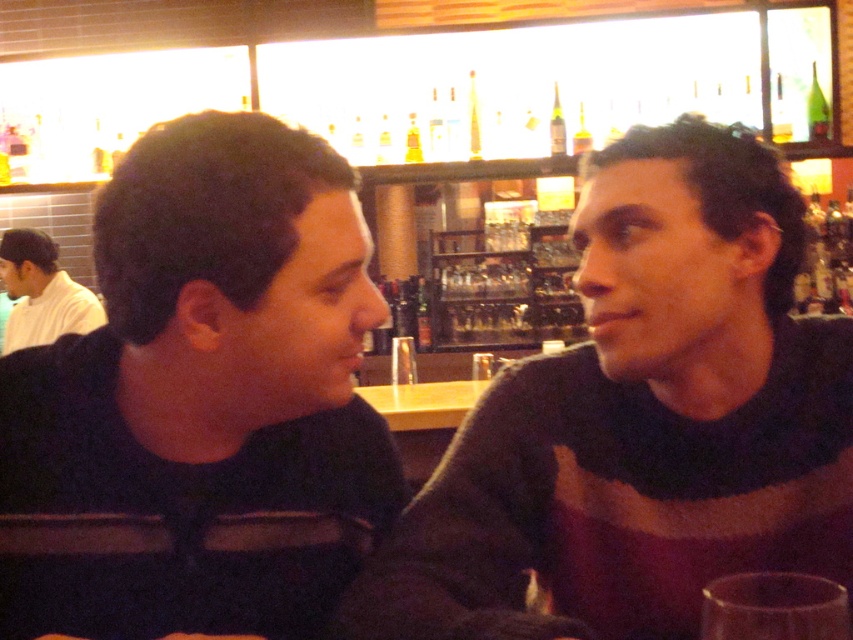
Question: Is dark brown sweater at center positioned before green glass bottle at upper right?

Choices:
 (A) no
 (B) yes

Answer: (B)

Question: Which point appears closest to the camera in this image?

Choices:
 (A) (57, 328)
 (B) (817, 132)
 (C) (775, 564)

Answer: (C)

Question: Which of the following is the farthest from the observer?

Choices:
 (A) (814, 93)
 (B) (45, 260)
 (C) (556, 112)
 (D) (763, 200)

Answer: (B)

Question: Can you confirm if dark blue sweater at left is positioned below white matte shirt at upper left?

Choices:
 (A) no
 (B) yes

Answer: (B)

Question: Is white matte shirt at upper left below green glass bottle at upper right?

Choices:
 (A) no
 (B) yes

Answer: (B)

Question: Which is nearer to the dark blue sweater at left?

Choices:
 (A) white matte shirt at upper left
 (B) green glass bottle at upper right
 (C) green glass bottle at upper center
 (D) dark brown sweater at center

Answer: (D)